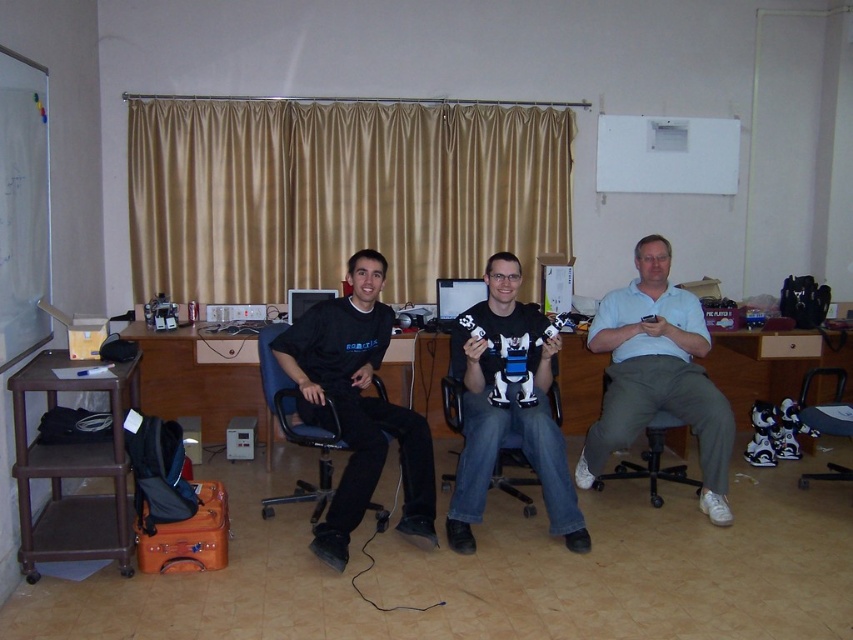
Is white cotton shirt at center closer to camera compared to brown wood computer desk at center?

Yes, it is.

Locate an element on the screen. white cotton shirt at center is located at coordinates (657, 374).

Can you confirm if blue plastic chair at left is taller than black plastic swivel chair at lower right?

Yes.

Which is more to the right, blue plastic chair at left or black plastic swivel chair at lower right?

black plastic swivel chair at lower right is more to the right.

Is point (282, 429) more distant than point (804, 394)?

No, (282, 429) is in front of (804, 394).

Image resolution: width=853 pixels, height=640 pixels. Identify the location of blue plastic chair at left. (294, 428).

This screenshot has width=853, height=640. Describe the element at coordinates (200, 378) in the screenshot. I see `brown wood computer desk at center` at that location.

Is point (236, 356) closer to camera compared to point (665, 420)?

No, (236, 356) is further to viewer.

Is point (216, 339) less distant than point (656, 481)?

No, it is behind (656, 481).

Where is `brown wood computer desk at center`? This screenshot has height=640, width=853. brown wood computer desk at center is located at coordinates (200, 378).